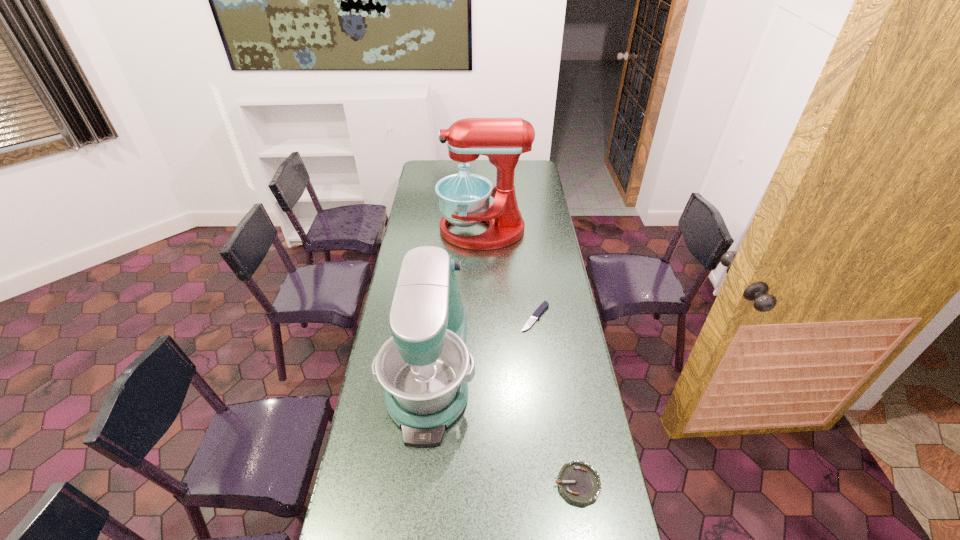
This screenshot has width=960, height=540. I want to click on vacant area between the second tallest object and the shortest object, so tap(483, 344).

The height and width of the screenshot is (540, 960). I want to click on free space between the shortest object and the taller mixer, so click(x=509, y=274).

The height and width of the screenshot is (540, 960). Find the location of `unoccupied area between the shortest object and the third tallest object`. unoccupied area between the shortest object and the third tallest object is located at coordinates (556, 401).

What are the coordinates of `free spot between the second shortest object and the shortest object` in the screenshot? It's located at (556, 401).

You are a GUI agent. You are given a task and a screenshot of the screen. Output one action in this format:
    pyautogui.click(x=<x>, y=<y>)
    Task: Click on the free spot between the shorter mixer and the second shortest object
    The height and width of the screenshot is (540, 960).
    Given the screenshot: What is the action you would take?
    pos(504,427)

Image resolution: width=960 pixels, height=540 pixels. What are the coordinates of `empty location between the steak knife and the ashtray` in the screenshot? It's located at (556, 401).

The width and height of the screenshot is (960, 540). I want to click on free space that is in between the nearer mixer and the ashtray, so click(504, 427).

Identify which object is the nearest to the farther mixer. Please provide its 2D coordinates. Your answer should be formatted as a tuple, i.e. [(x, y)], where the tuple contains the x and y coordinates of a point satisfying the conditions above.

[(538, 312)]

Locate which object ranks second in proximity to the ashtray. Please provide its 2D coordinates. Your answer should be formatted as a tuple, i.e. [(x, y)], where the tuple contains the x and y coordinates of a point satisfying the conditions above.

[(538, 312)]

Where is `vacant space that satisfies the following two spatial constraints: 1. on the front-facing side of the farthest object; 2. on the front-facing side of the nearer mixer`? This screenshot has width=960, height=540. vacant space that satisfies the following two spatial constraints: 1. on the front-facing side of the farthest object; 2. on the front-facing side of the nearer mixer is located at coordinates (484, 370).